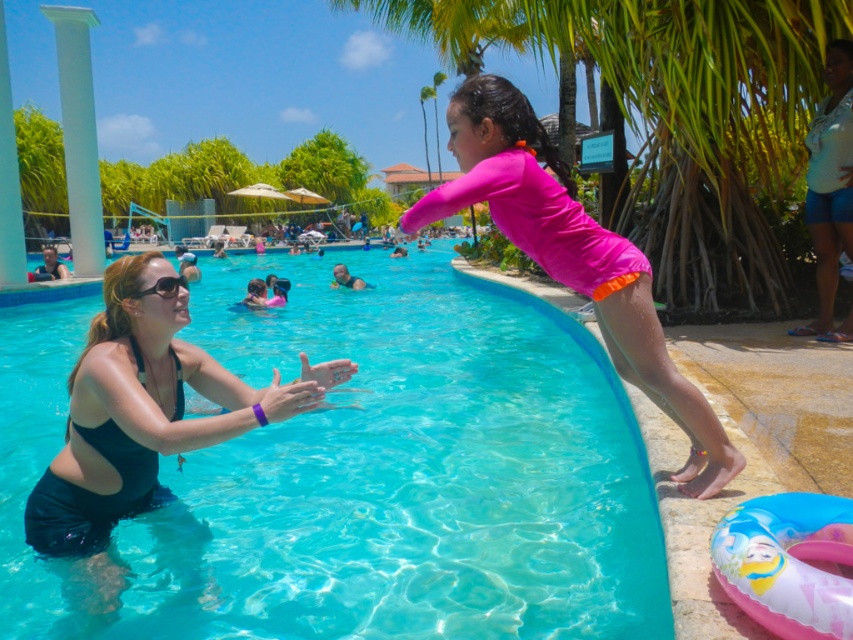
Question: In this image, where is green leafy palm tree at upper center located relative to black rubber goggles at upper center?

Choices:
 (A) below
 (B) above

Answer: (B)

Question: Does green leafy palm tree at upper center have a lesser width compared to black rubber goggles at upper center?

Choices:
 (A) no
 (B) yes

Answer: (A)

Question: Which object is farther from the camera taking this photo?

Choices:
 (A) black rubber goggles at upper center
 (B) black matte swimsuit at left

Answer: (A)

Question: Estimate the real-world distances between objects in this image. Which object is closer to the black rubber goggles at upper center?

Choices:
 (A) pink matte swimsuit at upper right
 (B) green leafy palm tree at upper center
 (C) transparent plastic pool at center

Answer: (A)

Question: Can you confirm if pink matte swimsuit at upper right is thinner than blue denim shorts at right?

Choices:
 (A) no
 (B) yes

Answer: (A)

Question: Among these points, which one is nearest to the camera?

Choices:
 (A) (115, 342)
 (B) (228, 275)
 (C) (717, 244)
 (D) (169, 275)

Answer: (A)